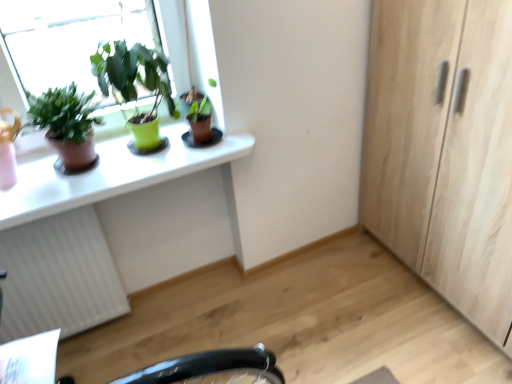
Where is `free space in front of matte brown pot at upper left, arranged as the 3th houseplant when viewed from the right`? Image resolution: width=512 pixels, height=384 pixels. free space in front of matte brown pot at upper left, arranged as the 3th houseplant when viewed from the right is located at coordinates (58, 197).